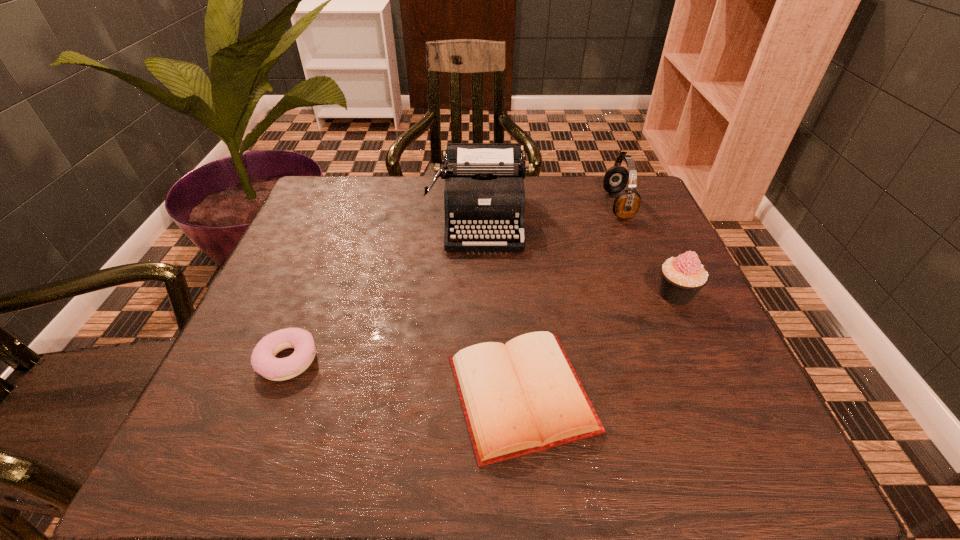
Find the location of a particular element. This screenshot has width=960, height=540. unoccupied area between the second shortest object and the typewriter is located at coordinates (385, 289).

I want to click on free space between the headset and the leftmost object, so click(x=453, y=282).

Find the location of a particular element. This screenshot has width=960, height=540. vacant area between the headset and the shortest object is located at coordinates (569, 299).

Where is `free spot between the third tallest object and the headset`? This screenshot has width=960, height=540. free spot between the third tallest object and the headset is located at coordinates (647, 249).

Find the location of `free space between the typewriter and the headset`. free space between the typewriter and the headset is located at coordinates (549, 212).

At what (x,y) coordinates should I click in order to perform the action: click on vacant area that lies between the cupcake and the headset. Please return your answer as a coordinate pair (x, y). This screenshot has width=960, height=540. Looking at the image, I should click on (647, 249).

Identify the location of the third closest object relative to the typewriter. The image size is (960, 540). (682, 277).

Locate which object ranks in proximity to the headset. Please provide its 2D coordinates. Your answer should be formatted as a tuple, i.e. [(x, y)], where the tuple contains the x and y coordinates of a point satisfying the conditions above.

[(484, 193)]

Image resolution: width=960 pixels, height=540 pixels. I want to click on free space that satisfies the following two spatial constraints: 1. on the back side of the third nearest object; 2. on the right side of the leftmost object, so click(x=315, y=294).

At what (x,y) coordinates should I click in order to perform the action: click on vacant position in the image that satisfies the following two spatial constraints: 1. on the ear cups of the headset; 2. on the left side of the cupcake. Please return your answer as a coordinate pair (x, y). This screenshot has height=540, width=960. Looking at the image, I should click on pyautogui.click(x=655, y=294).